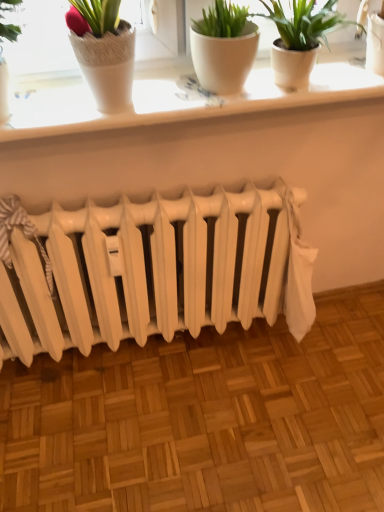
This screenshot has width=384, height=512. I want to click on vacant space underneath white matte radiator at center (from a real-world perspective), so click(150, 351).